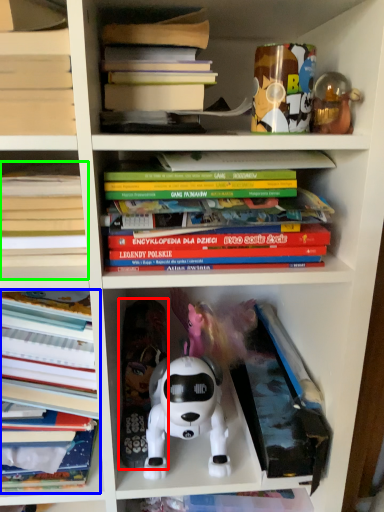
Question: Estimate the real-world distances between objects in this image. Which object is farther from toy (highlighted by a red box), book (highlighted by a blue box) or book (highlighted by a green box)?

Choices:
 (A) book
 (B) book

Answer: (B)